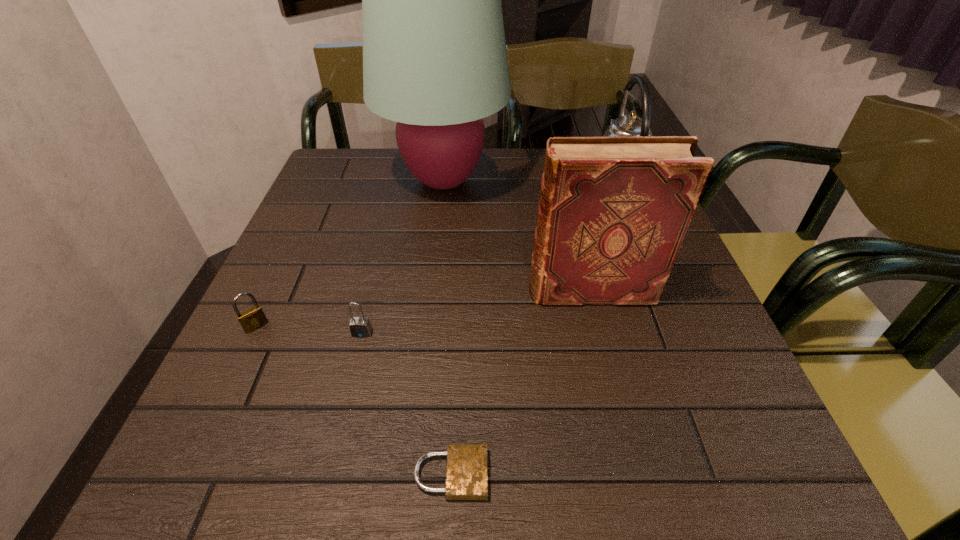
Where is `free spot between the tallest object and the kettle`? Image resolution: width=960 pixels, height=540 pixels. free spot between the tallest object and the kettle is located at coordinates (528, 188).

Locate an element on the screen. vacant region between the kettle and the nearest padlock is located at coordinates (532, 335).

Where is `unoccupied area between the third farthest object and the shortest padlock`? unoccupied area between the third farthest object and the shortest padlock is located at coordinates (521, 383).

This screenshot has width=960, height=540. I want to click on empty space that is in between the hardback book and the second padlock from left to right, so click(x=476, y=312).

Find the location of `free space that is in between the leftmost padlock and the hardback book`. free space that is in between the leftmost padlock and the hardback book is located at coordinates (423, 309).

In order to click on free space between the rightmost padlock and the kettle in this screenshot , I will do (532, 335).

The width and height of the screenshot is (960, 540). Find the location of `free space between the hardback book and the leftmost padlock`. free space between the hardback book and the leftmost padlock is located at coordinates (423, 309).

Find the location of a particular element. Image resolution: width=960 pixels, height=540 pixels. unoccupied area between the tallest object and the leftmost padlock is located at coordinates (350, 253).

Where is `object that is the fourth nearest to the leftmost padlock`? The height and width of the screenshot is (540, 960). object that is the fourth nearest to the leftmost padlock is located at coordinates (613, 213).

At what (x,y) coordinates should I click in order to perform the action: click on object that stands as the fifth closest to the lampshade. Please return your answer as a coordinate pair (x, y). This screenshot has width=960, height=540. Looking at the image, I should click on (466, 476).